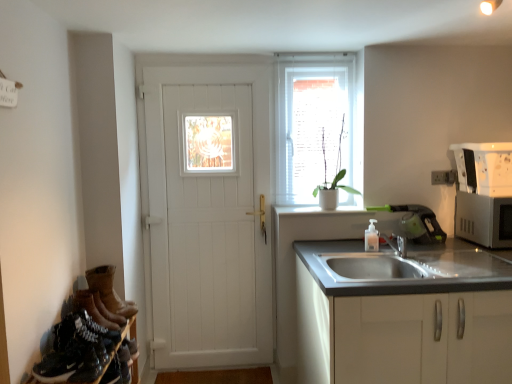
Question: Is silver metallic microwave at right to the left or to the right of white glossy window sill at center in the image?

Choices:
 (A) right
 (B) left

Answer: (A)

Question: Based on their sizes in the image, would you say silver metallic microwave at right is bigger or smaller than white glossy window sill at center?

Choices:
 (A) small
 (B) big

Answer: (B)

Question: Estimate the real-world distances between objects in this image. Which object is farther from the white ceramic pot at window?

Choices:
 (A) brown suede boots at lower left
 (B) white matte window at center
 (C) silver metallic microwave at right
 (D) black leather shoes at lower left
 (E) white matte cabinet at lower right

Answer: (D)

Question: Considering the real-world distances, which object is closest to the white ceramic pot at window?

Choices:
 (A) white matte cabinet at lower right
 (B) translucent plastic soap dispenser at sink right
 (C) white matte window at center
 (D) silver metallic microwave at right
 (E) white glossy window sill at center

Answer: (C)